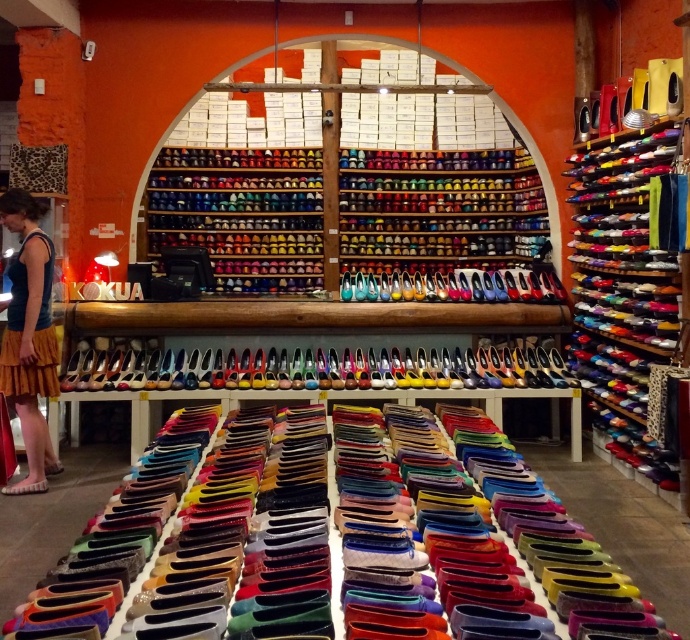
Question: Can you confirm if yellow textured skirt at lower left is positioned below wooden table at center?

Choices:
 (A) yes
 (B) no

Answer: (B)

Question: Which object is farther from the camera taking this photo?

Choices:
 (A) wooden table at center
 (B) yellow textured skirt at lower left

Answer: (A)

Question: Which point is closer to the camera taking this photo?

Choices:
 (A) 386,394
 (B) 34,291

Answer: (B)

Question: Can you confirm if yellow textured skirt at lower left is thinner than wooden table at center?

Choices:
 (A) no
 (B) yes

Answer: (B)

Question: Is yellow textured skirt at lower left thinner than wooden table at center?

Choices:
 (A) no
 (B) yes

Answer: (B)